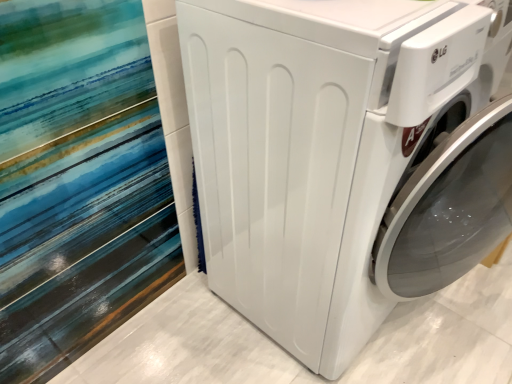
This screenshot has height=384, width=512. Describe the element at coordinates (345, 157) in the screenshot. I see `white glossy washing machine at center` at that location.

Identify the location of white glossy washing machine at center. The width and height of the screenshot is (512, 384). point(345,157).

Locate an element on the screen. The height and width of the screenshot is (384, 512). white glossy washing machine at center is located at coordinates (345, 157).